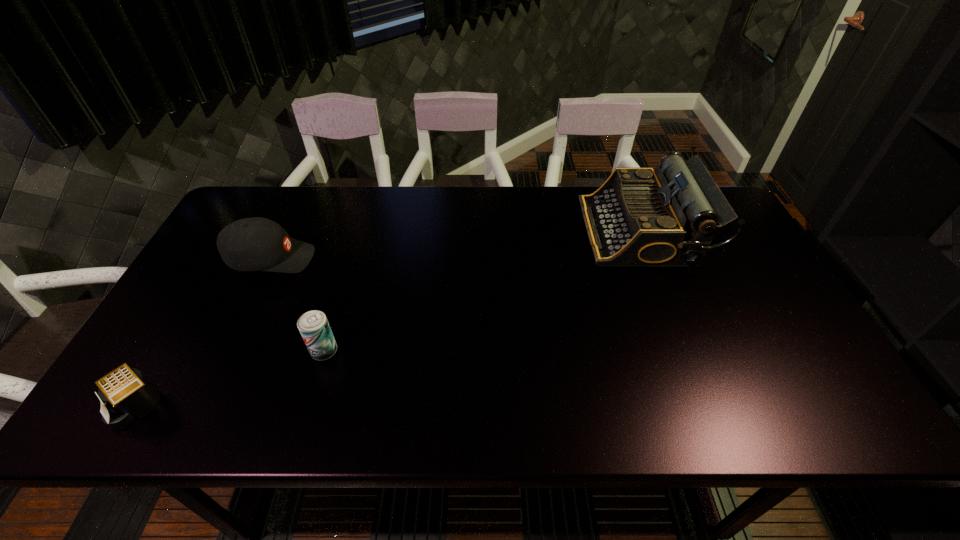
This screenshot has width=960, height=540. What are the coordinates of `the rightmost object` in the screenshot? It's located at (639, 217).

The image size is (960, 540). Identify the location of the tallest object. (639, 217).

Locate an element on the screen. This screenshot has height=540, width=960. baseball cap is located at coordinates (251, 244).

You are a GUI agent. You are given a task and a screenshot of the screen. Output one action in this format:
    pyautogui.click(x=<x>, y=<y>)
    Task: Click on the beer can
    This screenshot has height=540, width=960.
    Given the screenshot: What is the action you would take?
    pyautogui.click(x=315, y=330)

This screenshot has height=540, width=960. Find the location of `the second object from right to left`. the second object from right to left is located at coordinates (315, 330).

I want to click on calculator, so click(128, 395).

Image resolution: width=960 pixels, height=540 pixels. In order to click on the nearest object in this screenshot , I will do `click(128, 395)`.

The image size is (960, 540). Find the location of `vacant space located 0.350m on the keyboard of the rightmost object`. vacant space located 0.350m on the keyboard of the rightmost object is located at coordinates tap(472, 231).

Locate an element on the screen. This screenshot has width=960, height=540. blank area located on the keyboard of the rightmost object is located at coordinates (504, 231).

Where is `vacant space situated 0.320m on the keyboard of the rightmost object`? This screenshot has width=960, height=540. vacant space situated 0.320m on the keyboard of the rightmost object is located at coordinates (482, 231).